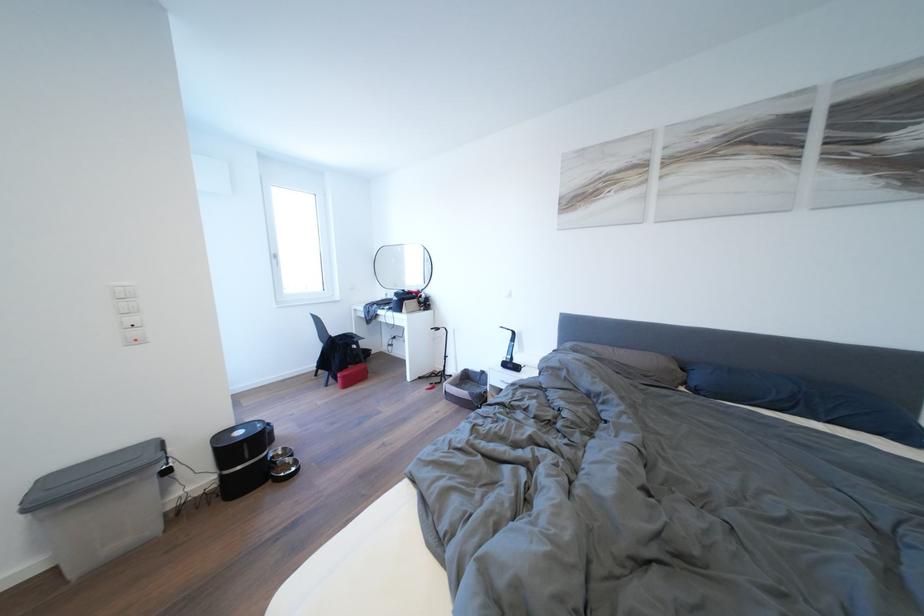
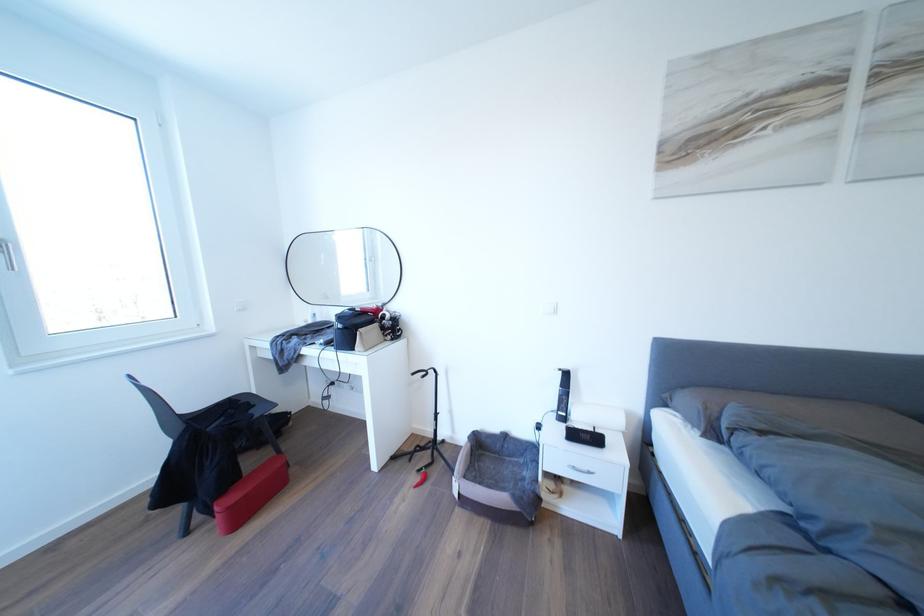
The point at (404, 291) is marked in the first image. Where is the corresponding point in the second image?

(334, 302)